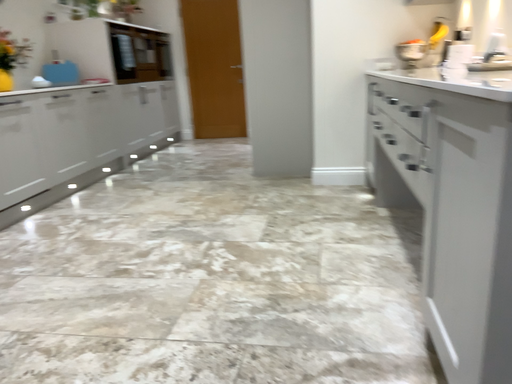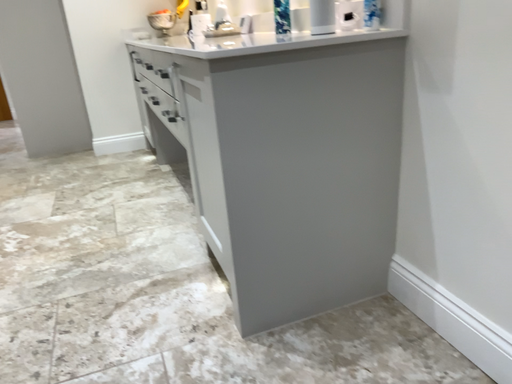
Question: How did the camera likely rotate when shooting the video?

Choices:
 (A) rotated right
 (B) rotated left

Answer: (A)